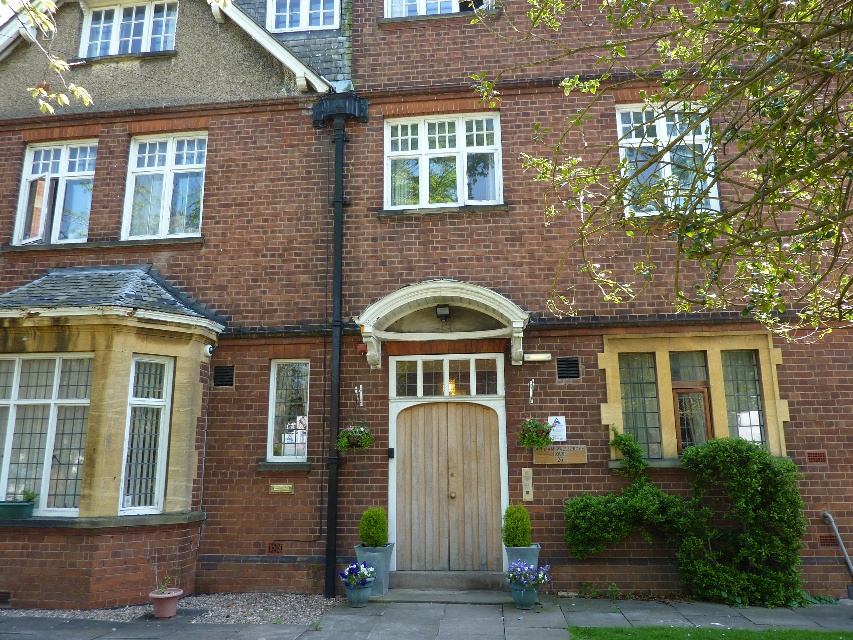
Question: Is natural wood door at center further to the viewer compared to black metal pipe at center?

Choices:
 (A) yes
 (B) no

Answer: (B)

Question: Is natural wood door at center further to camera compared to black metal pipe at center?

Choices:
 (A) no
 (B) yes

Answer: (A)

Question: Can you confirm if natural wood door at center is positioned below black metal pipe at center?

Choices:
 (A) no
 (B) yes

Answer: (B)